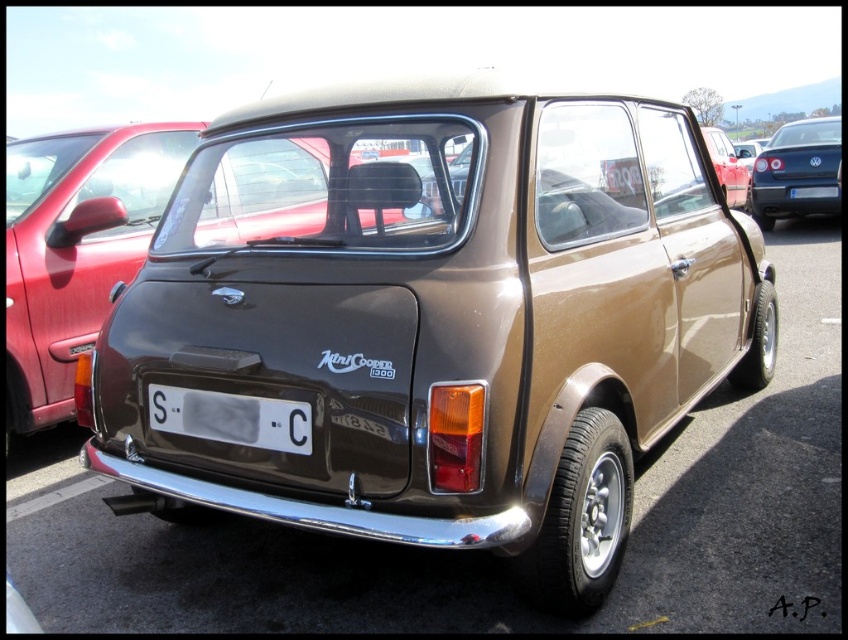
Looking at this image, you are standing at point 0.5, 0.1. You want to move to the shiny brown car at center. Which direction should you go?

Since you are at (84, 320) and the shiny brown car at center is at (76, 248), you should move to the left to reach it.

You are standing behind the classic Mini Cooper 1300 car in the parking lot. You notice a point at coordinates (76, 248). What object is located at that point?

The point at coordinates (76, 248) indicates the shiny brown car at center.

You are a photographer trying to capture the white plastic license plate at center and the shiny blue sedan at upper right in the same frame. Which object will appear wider in the photo?

The shiny blue sedan at upper right will appear wider in the photo because its width surpasses that of the white plastic license plate at center.